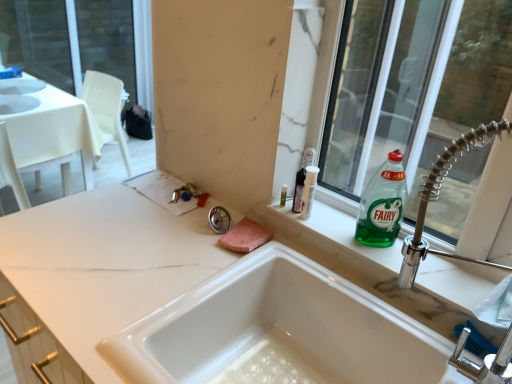
Describe the element at coordinates (279, 332) in the screenshot. I see `white glossy sink at center` at that location.

Find the location of a particular element. The height and width of the screenshot is (384, 512). white glossy sink at upper left is located at coordinates (19, 95).

What is the approximate height of white marble countertop at center?

white marble countertop at center is 86.50 centimeters in height.

Find the location of `white marble countertop at center`. white marble countertop at center is located at coordinates (104, 264).

This screenshot has width=512, height=384. Identify the location of white glossy sink at center. pyautogui.click(x=279, y=332).

Is translucent plastic bottle at upper right not near transparent glass window at upper right?

They are positioned close to each other.

Considering the sizes of objects translucent plastic bottle at upper right and transparent glass window at upper right in the image provided, who is bigger, translucent plastic bottle at upper right or transparent glass window at upper right?

Bigger between the two is transparent glass window at upper right.

Looking at this image, is translucent plastic bottle at upper right positioned with its back to transparent glass window at upper right?

Yes, translucent plastic bottle at upper right is positioned with its back facing transparent glass window at upper right.

Considering the sizes of translucent plastic bottle at upper right and transparent glass window at upper right in the image, is translucent plastic bottle at upper right taller or shorter than transparent glass window at upper right?

Considering their sizes, translucent plastic bottle at upper right has less height than transparent glass window at upper right.

From the image's perspective, is white glossy sink at center under white marble countertop at center?

No, from the image's perspective, white glossy sink at center is not below white marble countertop at center.

From a real-world perspective, which is physically above, white glossy sink at center or white marble countertop at center?

white glossy sink at center, from a real-world perspective.

Is white glossy sink at center not close to white marble countertop at center?

No, white glossy sink at center is not far away from white marble countertop at center.

Is white glossy sink at center bigger than white marble countertop at center?

Incorrect, white glossy sink at center is not larger than white marble countertop at center.

In the scene shown: Would you say translucent plastic bottle at upper right is a long distance from green glass bottle at upper right?

translucent plastic bottle at upper right is actually quite close to green glass bottle at upper right.

Considering the points (312, 161) and (396, 199), which point is behind, point (312, 161) or point (396, 199)?

The point (312, 161) is behind.

Is translucent plastic bottle at upper right facing away from green glass bottle at upper right?

translucent plastic bottle at upper right does not have its back to green glass bottle at upper right.

From the picture: Could you measure the distance between transparent glass window at upper right and translucent plastic bottle at upper right?

transparent glass window at upper right is 24.98 inches from translucent plastic bottle at upper right.

Between transparent glass window at upper right and translucent plastic bottle at upper right, which one is positioned in front?

Positioned in front is transparent glass window at upper right.

Is transparent glass window at upper right spatially inside translucent plastic bottle at upper right, or outside of it?

transparent glass window at upper right cannot be found inside translucent plastic bottle at upper right.

The width and height of the screenshot is (512, 384). In order to click on window that appears on the right of green glass bottle at upper right in this screenshot , I will do `click(415, 81)`.

In terms of height, does green glass bottle at upper right look taller or shorter compared to transparent glass window at upper right?

Clearly, green glass bottle at upper right is shorter compared to transparent glass window at upper right.

Is green glass bottle at upper right in contact with transparent glass window at upper right?

green glass bottle at upper right and transparent glass window at upper right are not in contact.

Measure the distance from green glass bottle at upper right to transparent glass window at upper right.

green glass bottle at upper right is 14.26 inches from transparent glass window at upper right.

Is transparent glass window at upper right bigger or smaller than white glossy sink at upper left?

Clearly, transparent glass window at upper right is larger in size than white glossy sink at upper left.

Can you confirm if transparent glass window at upper right is wider than white glossy sink at upper left?

Incorrect, the width of transparent glass window at upper right does not surpass that of white glossy sink at upper left.

The image size is (512, 384). I want to click on sink beneath the transparent glass window at upper right (from a real-world perspective), so click(x=19, y=95).

From the image's perspective, does white glossy sink at upper left appear higher than transparent glass window at upper right?

Yes.

Considering the sizes of white glossy sink at upper left and transparent glass window at upper right in the image, is white glossy sink at upper left taller or shorter than transparent glass window at upper right?

In the image, white glossy sink at upper left appears to be shorter than transparent glass window at upper right.

Which object is further away from the camera taking this photo, white glossy sink at upper left or transparent glass window at upper right?

white glossy sink at upper left is more distant.

The height and width of the screenshot is (384, 512). In order to click on window that appears on the right of white glossy sink at upper left in this screenshot , I will do `click(415, 81)`.

Locate an element on the screen. window on the right of translucent plastic bottle at upper right is located at coordinates point(415,81).

Locate an element on the screen. This screenshot has width=512, height=384. tub lying behind the white marble countertop at center is located at coordinates (279, 332).

From the image, which object appears to be nearer to transparent glass window at upper right, white glossy sink at upper left or white glossy sink at center?

Among the two, white glossy sink at center is located nearer to transparent glass window at upper right.

Based on their spatial positions, is translucent plastic bottle at upper right or white glossy sink at center closer to white glossy sink at upper left?

translucent plastic bottle at upper right.

Estimate the real-world distances between objects in this image. Which object is closer to white marble countertop at center, white glossy sink at center or translucent plastic bottle at upper right?

white glossy sink at center is closer to white marble countertop at center.

Consider the image. When comparing their distances from white marble countertop at center, does white glossy sink at upper left or green glass bottle at upper right seem closer?

green glass bottle at upper right is closer to white marble countertop at center.

Which object lies nearer to the anchor point transparent glass window at upper right, white glossy sink at upper left or white marble countertop at center?

white marble countertop at center is closer to transparent glass window at upper right.

Estimate the real-world distances between objects in this image. Which object is further from translucent plastic bottle at upper right, transparent glass window at upper right or green glass bottle at upper right?

Based on the image, transparent glass window at upper right appears to be further to translucent plastic bottle at upper right.

When comparing their distances from white glossy sink at upper left, does white marble countertop at center or transparent glass window at upper right seem further?

The object further to white glossy sink at upper left is transparent glass window at upper right.

From the picture: From the image, which object appears to be farther from translucent plastic bottle at upper right, green glass bottle at upper right or transparent glass window at upper right?

transparent glass window at upper right is positioned further to the anchor translucent plastic bottle at upper right.

In order to click on cleaning product between transparent glass window at upper right and translucent plastic bottle at upper right in the front-back direction in this screenshot , I will do `click(382, 204)`.

The height and width of the screenshot is (384, 512). I want to click on toiletry between white glossy sink at upper left and green glass bottle at upper right in the horizontal direction, so click(302, 178).

Locate an element on the screen. The height and width of the screenshot is (384, 512). cleaning product between transparent glass window at upper right and white glossy sink at center in the vertical direction is located at coordinates (382, 204).

Locate an element on the screen. The width and height of the screenshot is (512, 384). tub situated between white glossy sink at upper left and green glass bottle at upper right from left to right is located at coordinates (279, 332).